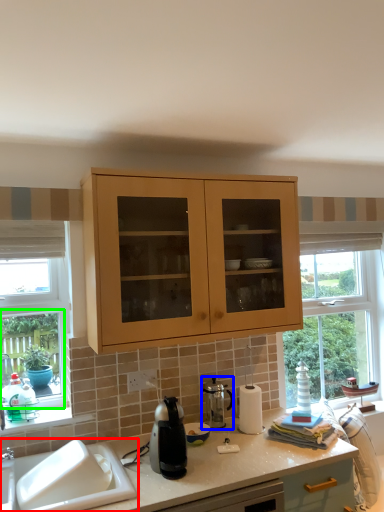
Question: Considering the real-world distances, which object is farthest from sink (highlighted by a red box)? appliance (highlighted by a blue box) or window frame (highlighted by a green box)?

Choices:
 (A) appliance
 (B) window frame

Answer: (A)